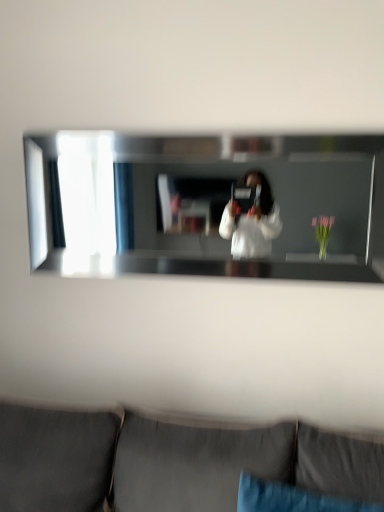
Question: Is clear glass mirror at center in front of or behind blue fabric pillow at lower center in the image?

Choices:
 (A) front
 (B) behind

Answer: (B)

Question: In terms of height, does clear glass mirror at center look taller or shorter compared to blue fabric pillow at lower center?

Choices:
 (A) short
 (B) tall

Answer: (B)

Question: Estimate the real-world distances between objects in this image. Which object is closer to the clear glass mirror at center?

Choices:
 (A) dark gray fabric couch at lower center
 (B) blue fabric pillow at lower center

Answer: (A)

Question: Based on their relative distances, which object is nearer to the clear glass mirror at center?

Choices:
 (A) blue fabric pillow at lower center
 (B) dark gray fabric couch at lower center

Answer: (B)